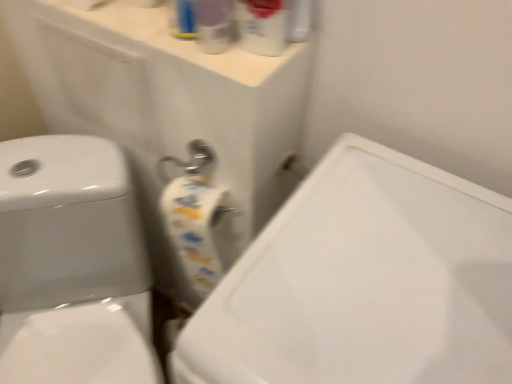
Question: Should I look upward or downward to see white glossy toilet at left?

Choices:
 (A) down
 (B) up

Answer: (A)

Question: From the image's perspective, does white glossy sink at center appear higher than translucent plastic spray bottle at upper center, which ranks as the 1th cleaning product in left-to-right order?

Choices:
 (A) yes
 (B) no

Answer: (B)

Question: Is white glossy sink at center positioned in front of translucent plastic spray bottle at upper center, which ranks as the 1th cleaning product in left-to-right order?

Choices:
 (A) yes
 (B) no

Answer: (A)

Question: From the image's perspective, is white glossy sink at center under translucent plastic spray bottle at upper center, the second cleaning product when ordered from right to left?

Choices:
 (A) no
 (B) yes

Answer: (B)

Question: Can you confirm if white glossy sink at center is wider than translucent plastic spray bottle at upper center, the second cleaning product when ordered from right to left?

Choices:
 (A) no
 (B) yes

Answer: (B)

Question: Does white glossy sink at center turn towards translucent plastic spray bottle at upper center, which ranks as the 1th cleaning product in left-to-right order?

Choices:
 (A) yes
 (B) no

Answer: (B)

Question: From a real-world perspective, is white glossy sink at center positioned over translucent plastic spray bottle at upper center, which ranks as the 1th cleaning product in left-to-right order, based on gravity?

Choices:
 (A) yes
 (B) no

Answer: (B)

Question: From the image's perspective, is translucent plastic spray bottle at upper center, which is the second cleaning product from left to right, under white glossy sink at center?

Choices:
 (A) no
 (B) yes

Answer: (A)

Question: Is translucent plastic spray bottle at upper center, which is the second cleaning product from left to right, to the left of white glossy sink at center from the viewer's perspective?

Choices:
 (A) yes
 (B) no

Answer: (A)

Question: Is translucent plastic spray bottle at upper center, which is the second cleaning product from left to right, smaller than white glossy sink at center?

Choices:
 (A) yes
 (B) no

Answer: (A)

Question: Does translucent plastic spray bottle at upper center, the 1th cleaning product in the right-to-left sequence, have a greater width compared to white glossy sink at center?

Choices:
 (A) no
 (B) yes

Answer: (A)

Question: Considering the relative sizes of translucent plastic spray bottle at upper center, the 1th cleaning product in the right-to-left sequence, and white glossy sink at center in the image provided, is translucent plastic spray bottle at upper center, the 1th cleaning product in the right-to-left sequence, thinner than white glossy sink at center?

Choices:
 (A) no
 (B) yes

Answer: (B)

Question: Is translucent plastic spray bottle at upper center, the 1th cleaning product in the right-to-left sequence, positioned beyond the bounds of translucent plastic spray bottle at upper center, the second cleaning product when ordered from right to left?

Choices:
 (A) no
 (B) yes

Answer: (B)